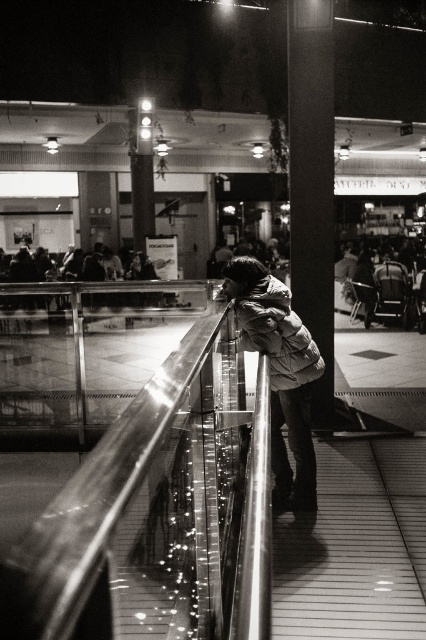
Question: Can you confirm if smooth concrete pillar at center is positioned above white puffy jacket at center?

Choices:
 (A) no
 (B) yes

Answer: (B)

Question: Among these points, which one is nearest to the camera?

Choices:
 (A) (288, 134)
 (B) (278, 342)

Answer: (B)

Question: Which of the following is the farthest from the observer?

Choices:
 (A) smooth concrete pillar at center
 (B) white puffy jacket at center

Answer: (A)

Question: Does smooth concrete pillar at center appear on the left side of white puffy jacket at center?

Choices:
 (A) yes
 (B) no

Answer: (B)

Question: Can you confirm if smooth concrete pillar at center is positioned above white puffy jacket at center?

Choices:
 (A) no
 (B) yes

Answer: (B)